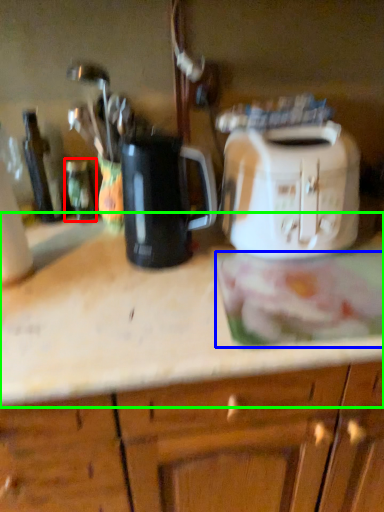
Question: Estimate the real-world distances between objects in this image. Which object is closer to bottle (highlighted by a red box), food (highlighted by a blue box) or countertop (highlighted by a green box)?

Choices:
 (A) food
 (B) countertop

Answer: (B)